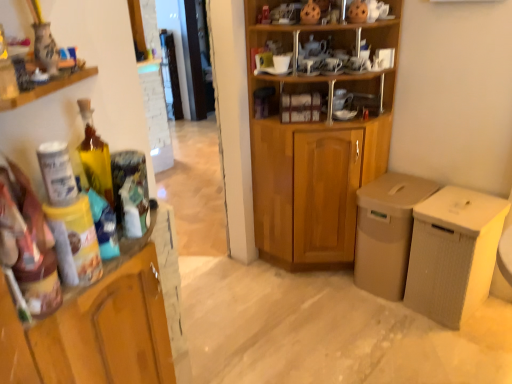
At what (x,y) coordinates should I click in order to perform the action: click on vacant space in front of wooden cupboard at center. Please return your answer as a coordinate pair (x, y). Image resolution: width=512 pixels, height=384 pixels. Looking at the image, I should click on (328, 319).